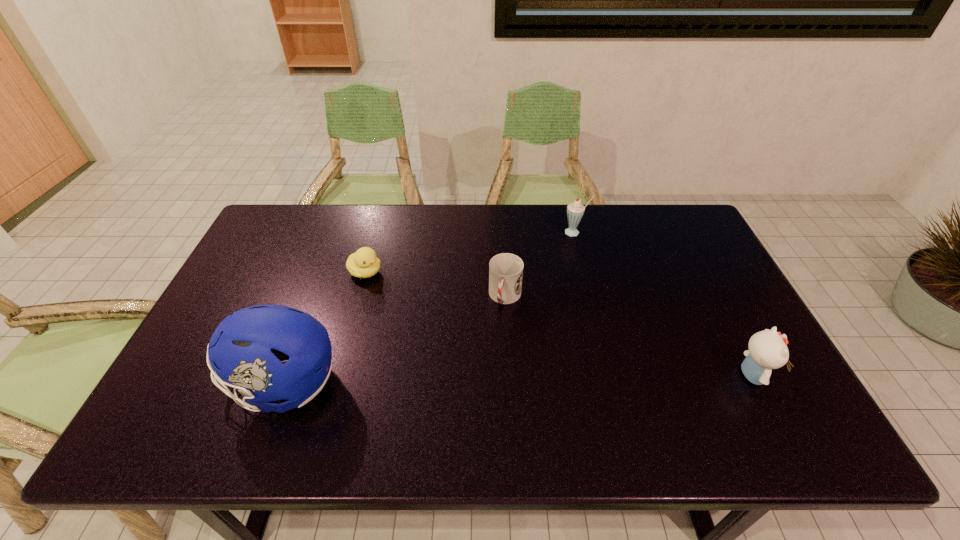
This screenshot has width=960, height=540. Find the location of `free spot located at the beak of the duckling`. free spot located at the beak of the duckling is located at coordinates (401, 293).

Where is `free space located 0.140m at the beak of the duckling`? free space located 0.140m at the beak of the duckling is located at coordinates (411, 299).

Find the location of a particular element. This screenshot has width=960, height=540. vacant region located 0.160m at the beak of the duckling is located at coordinates (417, 302).

Locate an element on the screen. The height and width of the screenshot is (540, 960). free space located on the straw side of the farthest object is located at coordinates (550, 265).

Where is `blank space located on the straw side of the farthest object`? The image size is (960, 540). blank space located on the straw side of the farthest object is located at coordinates (554, 259).

You are a GUI agent. You are given a task and a screenshot of the screen. Output one action in this format:
    pyautogui.click(x=<x>, y=<y>)
    Task: Click on the free space located 0.320m on the straw side of the farthest object
    
    Given the screenshot: What is the action you would take?
    pyautogui.click(x=528, y=297)

You are a GUI agent. You are given a task and a screenshot of the screen. Output one action in this format:
    pyautogui.click(x=<x>, y=<y>)
    Task: Click on the object that is at the far edge
    The height and width of the screenshot is (540, 960).
    Given the screenshot: What is the action you would take?
    pyautogui.click(x=575, y=210)

Where is `football helmet that is at the near edge`? Image resolution: width=960 pixels, height=540 pixels. football helmet that is at the near edge is located at coordinates (246, 349).

Image resolution: width=960 pixels, height=540 pixels. What are the coordinates of `kitten present at the near edge` in the screenshot? It's located at [768, 350].

The width and height of the screenshot is (960, 540). In order to click on object that is at the left edge in this screenshot , I will do `click(246, 349)`.